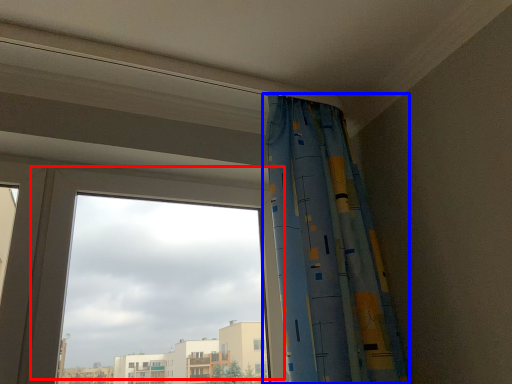
Question: Which object appears closest to the camera in this image, window (highlighted by a red box) or curtain (highlighted by a blue box)?

Choices:
 (A) window
 (B) curtain

Answer: (B)